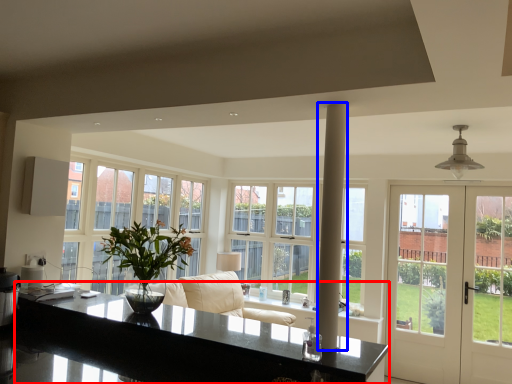
Question: Which point is closer to the camera, countertop (highlighted by a red box) or pillar (highlighted by a blue box)?

Choices:
 (A) countertop
 (B) pillar

Answer: (A)